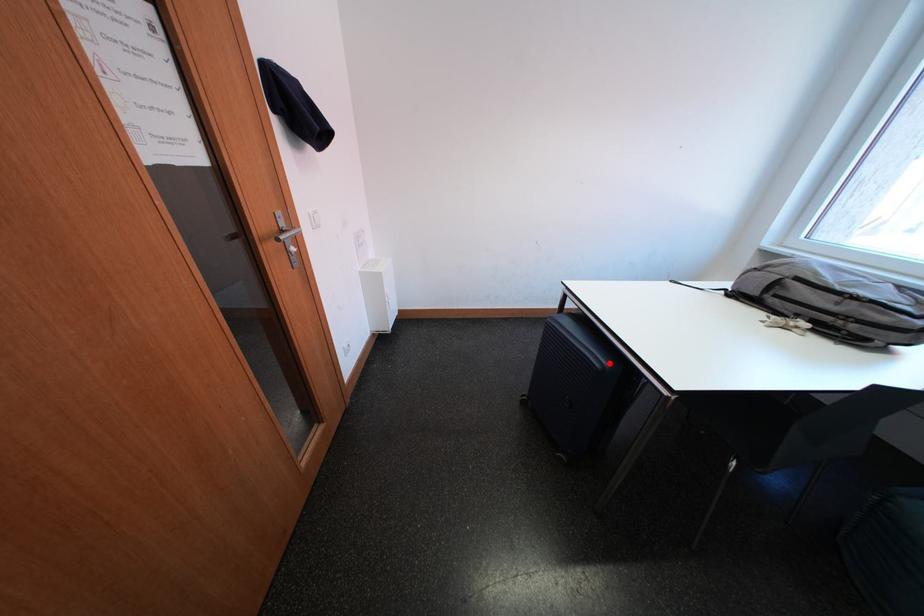
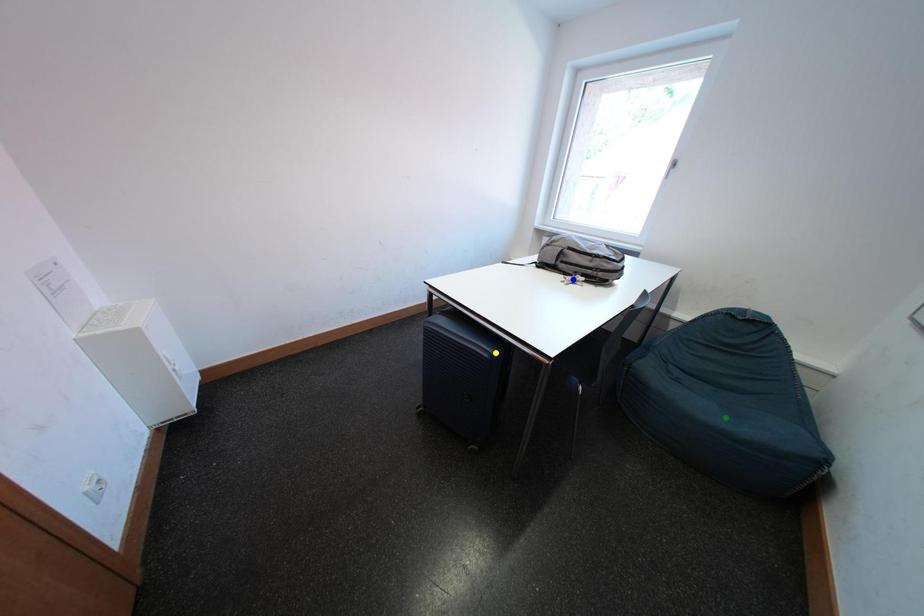
Question: I am providing you with two images of the same scene from different viewpoints. A red point is marked on the first image. You are given multiple points on the second image. Which point in image 2 is actually the same real-world point as the red point in image 1?

Choices:
 (A) yellow point
 (B) blue point
 (C) green point

Answer: (A)